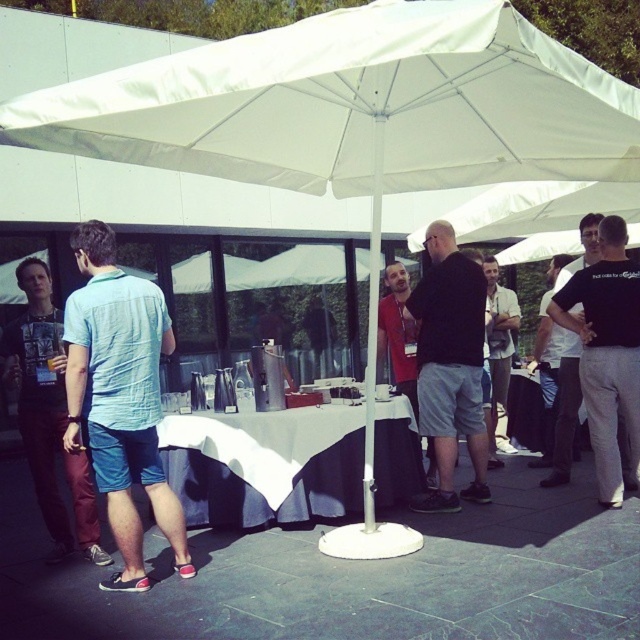
Is the position of light blue denim shorts at center less distant than that of matte black shirt at center?

Yes, it is.

Does point (51, 460) come in front of point (493, 272)?

Yes, it is in front of point (493, 272).

Locate an element on the screen. Image resolution: width=640 pixels, height=640 pixels. light blue denim shorts at center is located at coordinates (49, 413).

Which of these two, white cloth at center or black cotton t-shirt at right, stands shorter?

Standing shorter between the two is white cloth at center.

This screenshot has width=640, height=640. What are the coordinates of `white cloth at center` in the screenshot? It's located at (266, 465).

Does light blue striped shirt at center have a greater width compared to black matte shirt at center?

Incorrect, light blue striped shirt at center's width does not surpass black matte shirt at center's.

Is point (96, 388) less distant than point (448, 385)?

Yes, it is.

The height and width of the screenshot is (640, 640). Identify the location of light blue striped shirt at center. (120, 396).